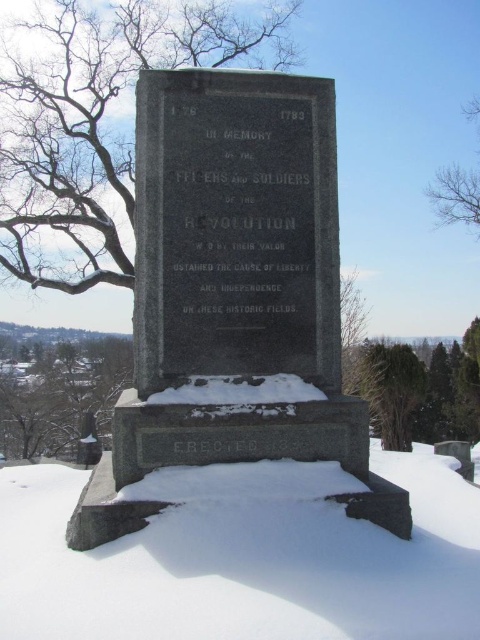
Is green leafy tree at lower right below bare branches at upper right?

Yes.

Which is below, green leafy tree at lower right or bare branches at upper right?

Positioned lower is green leafy tree at lower right.

Between point (404, 435) and point (455, 188), which one is positioned in front?

Point (404, 435)

Identify the location of green leafy tree at lower right. This screenshot has width=480, height=640. (421, 390).

Who is taller, green leafy tree at lower right or green textured evergreen tree at right?

Standing taller between the two is green textured evergreen tree at right.

Is point (352, 384) closer to camera compared to point (379, 376)?

Yes, it is.

This screenshot has width=480, height=640. Describe the element at coordinates (421, 390) in the screenshot. I see `green leafy tree at lower right` at that location.

Where is `green leafy tree at lower right`? The width and height of the screenshot is (480, 640). green leafy tree at lower right is located at coordinates (421, 390).

Can you confirm if bare branches at upper left is taller than green textured evergreen tree at right?

Correct, bare branches at upper left is much taller as green textured evergreen tree at right.

Can you confirm if bare branches at upper left is positioned to the right of green textured evergreen tree at right?

No, bare branches at upper left is not to the right of green textured evergreen tree at right.

Measure the distance between point (38, 243) and camera.

A distance of 75.38 feet exists between point (38, 243) and camera.

You are a GUI agent. You are given a task and a screenshot of the screen. Output one action in this format:
    pyautogui.click(x=<x>, y=<y>)
    Task: Click on the bare branches at upper left
    This screenshot has width=480, height=640.
    Given the screenshot: What is the action you would take?
    pyautogui.click(x=98, y=120)